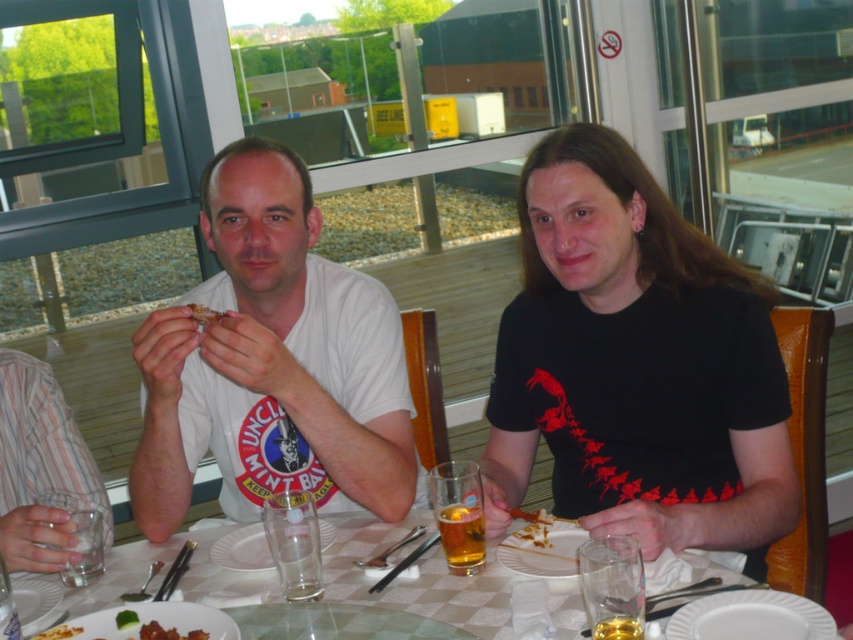
Which of these two, white paper plate at center or translucent glass beverage at table center, stands taller?

white paper plate at center is taller.

Locate an element on the screen. The width and height of the screenshot is (853, 640). white paper plate at center is located at coordinates (242, 548).

Is point (258, 554) more distant than point (613, 624)?

Yes, point (258, 554) is farther from viewer.

You are a GUI agent. You are given a task and a screenshot of the screen. Output one action in this format:
    pyautogui.click(x=<x>, y=<y>)
    Task: Click on the white paper plate at center
    The width and height of the screenshot is (853, 640).
    Given the screenshot: What is the action you would take?
    pyautogui.click(x=242, y=548)

Who is lower down, white ceramic plate at lower right or white glossy plate at lower left?

white glossy plate at lower left is lower down.

Who is taller, white ceramic plate at lower right or white glossy plate at lower left?

white ceramic plate at lower right

Which is in front, point (833, 620) or point (16, 611)?

Point (833, 620) is in front.

Identify the location of white ceramic plate at lower right. (751, 618).

Which is more to the right, translucent glass beer at center or white paper plate at center?

From the viewer's perspective, translucent glass beer at center appears more on the right side.

Does translucent glass beer at center appear over white paper plate at center?

Yes.

Is point (483, 531) more distant than point (239, 550)?

No, (483, 531) is closer to viewer.

At what (x,y) coordinates should I click in order to perform the action: click on translucent glass beer at center. Please return your answer as a coordinate pair (x, y). Looking at the image, I should click on (462, 536).